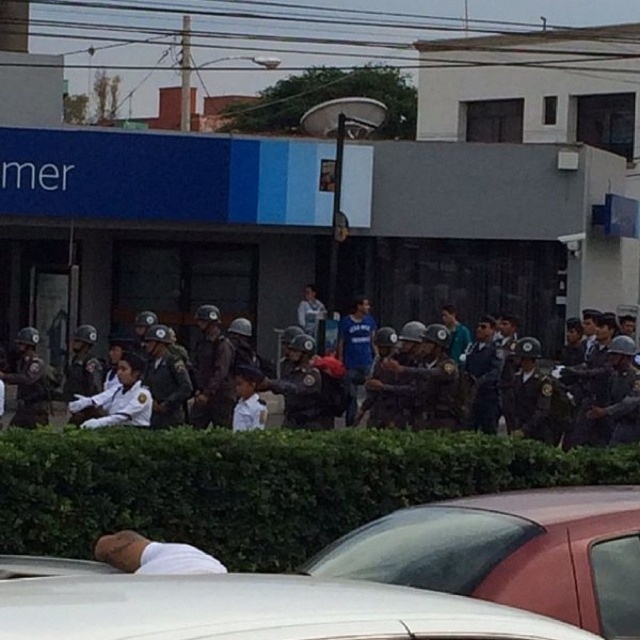
Can you confirm if white matte car at lower center is bigger than matte black helmets at center?

Indeed, white matte car at lower center has a larger size compared to matte black helmets at center.

Measure the distance between white matte car at lower center and camera.

A distance of 5.01 meters exists between white matte car at lower center and camera.

This screenshot has width=640, height=640. Describe the element at coordinates (372, 580) in the screenshot. I see `white matte car at lower center` at that location.

Locate an element on the screen. white matte car at lower center is located at coordinates (372, 580).